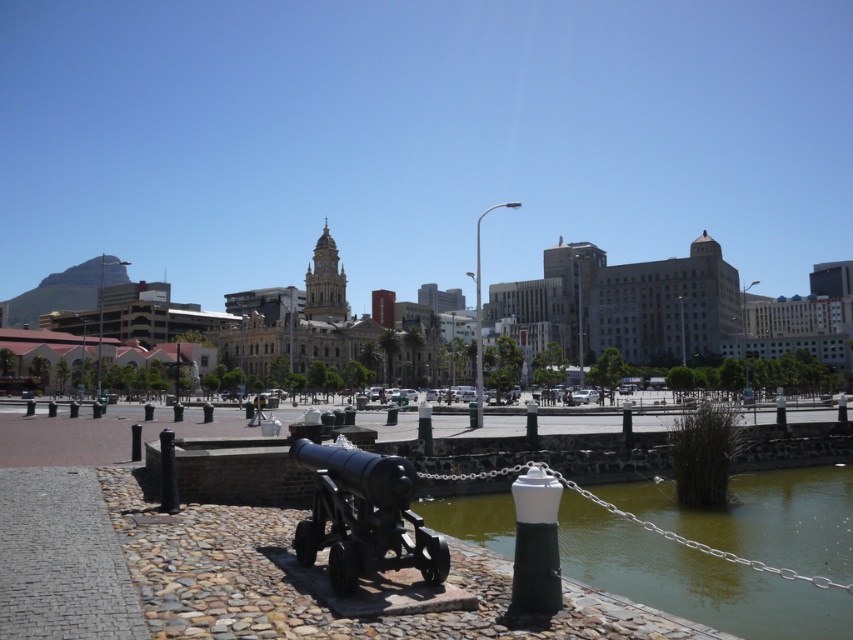
You are a tourist standing on the cobblestone pathway and want to take a photo of both the green stone river at lower center and the polished bronze cannon at center. Which object should you focus on first to ensure both are in the frame?

You should focus on the polished bronze cannon at center first because the green stone river at lower center is further away from you, so adjusting the camera to include both would require ensuring the cannon is centered before framing the river in the background.

You are standing at the cannon on the cobblestone pathway. You see two points in the scene, point (395, 529) and point (479, 323). Which point is closer to you?

Point (395, 529) is closer to you than point (479, 323).

You are standing at the starting point of the cobblestone pathway and want to place a new decorative statue exactly 1 meter to the right of the polished bronze cannon at center. Given that the cannon is located at coordinates 0.808, 0.427, can you determine the coordinates where the statue should be placed?

The statue should be placed at coordinates (363, 580) because moving 1 meter to the right from the polished bronze cannon at center at (363, 516) adds 0.1 to the x coordinate, resulting in 0.908, while keeping the y coordinate the same.